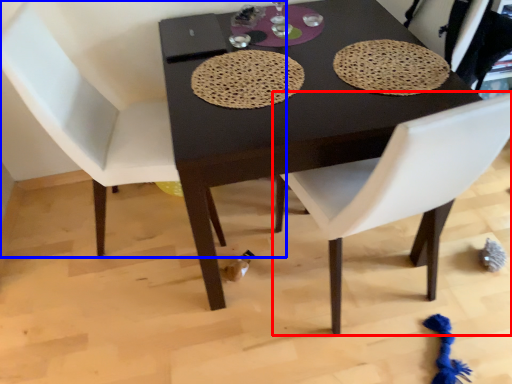
Question: Which of the following is the farthest to the observer, chair (highlighted by a red box) or chair (highlighted by a blue box)?

Choices:
 (A) chair
 (B) chair

Answer: (B)